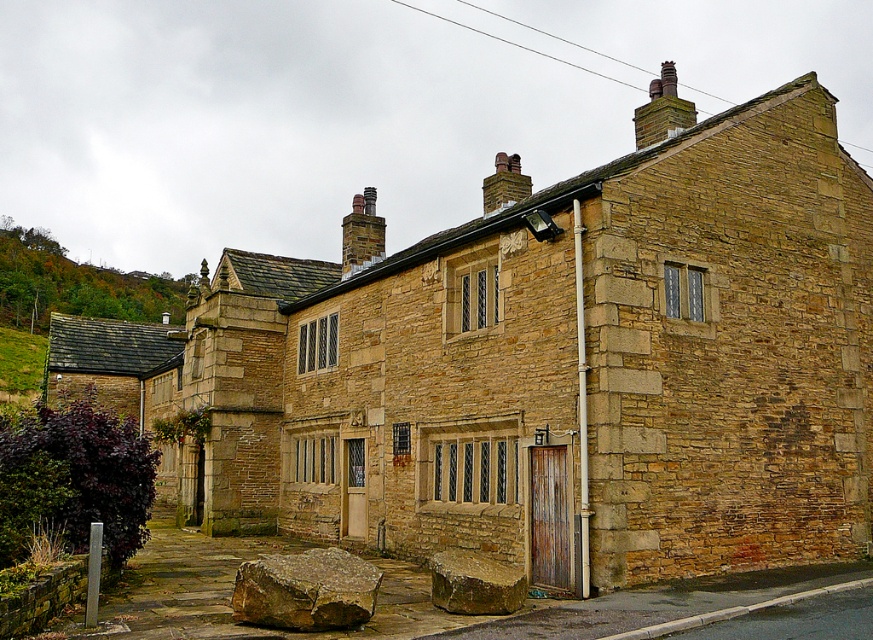
Does green leafy hillside at upper left have a lesser width compared to smooth brown rock at lower center?

In fact, green leafy hillside at upper left might be wider than smooth brown rock at lower center.

Looking at this image, does green leafy hillside at upper left come behind smooth brown rock at lower center?

That is True.

Measure the distance between point (38, 301) and camera.

Point (38, 301) and camera are 535.81 feet apart.

Identify the location of green leafy hillside at upper left. The height and width of the screenshot is (640, 873). (74, 284).

Which of these two, green leafy hillside at upper left or dark gray stone chimney at upper center, stands shorter?

green leafy hillside at upper left

Is green leafy hillside at upper left above dark gray stone chimney at upper center?

No, green leafy hillside at upper left is not above dark gray stone chimney at upper center.

The height and width of the screenshot is (640, 873). What do you see at coordinates (74, 284) in the screenshot? I see `green leafy hillside at upper left` at bounding box center [74, 284].

Locate an element on the screen. Image resolution: width=873 pixels, height=640 pixels. green leafy hillside at upper left is located at coordinates (74, 284).

Can you confirm if green leafy hillside at upper left is smaller than brown rough rock at lower center?

Incorrect, green leafy hillside at upper left is not smaller in size than brown rough rock at lower center.

Image resolution: width=873 pixels, height=640 pixels. I want to click on green leafy hillside at upper left, so click(x=74, y=284).

Is point (24, 321) more distant than point (290, 609)?

Yes, point (24, 321) is behind point (290, 609).

Where is `green leafy hillside at upper left`? green leafy hillside at upper left is located at coordinates (74, 284).